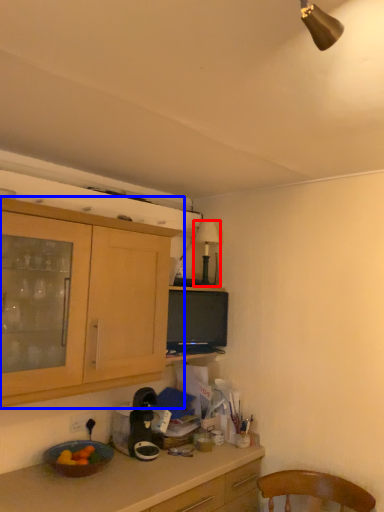
Question: Which object is further to the camera taking this photo, lamp (highlighted by a red box) or cabinetry (highlighted by a blue box)?

Choices:
 (A) lamp
 (B) cabinetry

Answer: (A)